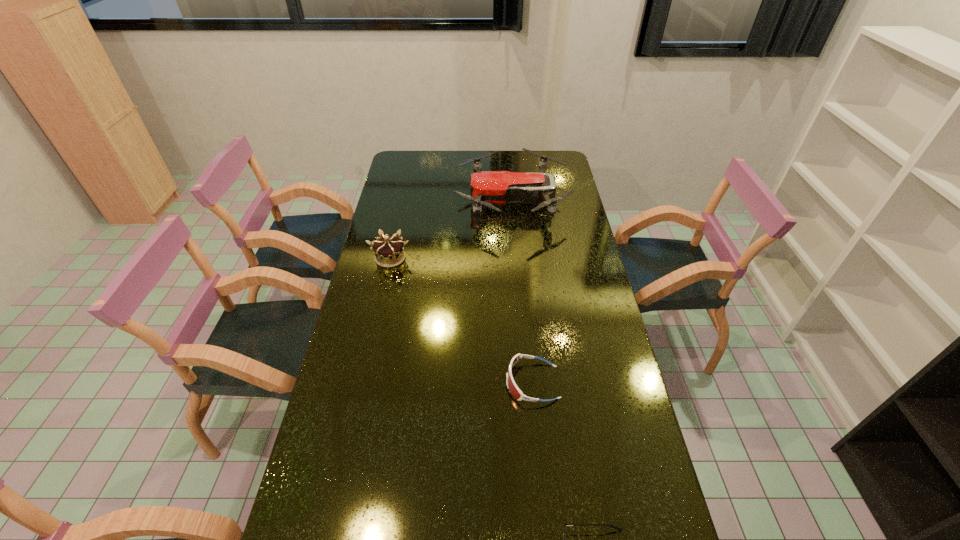
Image resolution: width=960 pixels, height=540 pixels. I want to click on drone, so click(488, 188).

Locate an element on the screen. Image resolution: width=960 pixels, height=540 pixels. the tallest object is located at coordinates pos(488,188).

This screenshot has height=540, width=960. In order to click on the third nearest object in this screenshot , I will do `click(389, 252)`.

Locate an element on the screen. the leftmost object is located at coordinates (389, 252).

Identify the location of the second nearest object. Image resolution: width=960 pixels, height=540 pixels. (513, 388).

I want to click on the second shortest object, so click(x=513, y=388).

Locate an element on the screen. The height and width of the screenshot is (540, 960). vacant region located on the front-facing side of the farthest object is located at coordinates (430, 202).

The width and height of the screenshot is (960, 540). I want to click on vacant area located 0.080m on the front-facing side of the farthest object, so click(437, 202).

At what (x,y) coordinates should I click in order to perform the action: click on vacant region located 0.100m on the front-facing side of the farthest object. Please return your answer as a coordinate pair (x, y). Looking at the image, I should click on (433, 202).

Where is `free space located on the right of the leftmost object`? This screenshot has width=960, height=540. free space located on the right of the leftmost object is located at coordinates (436, 258).